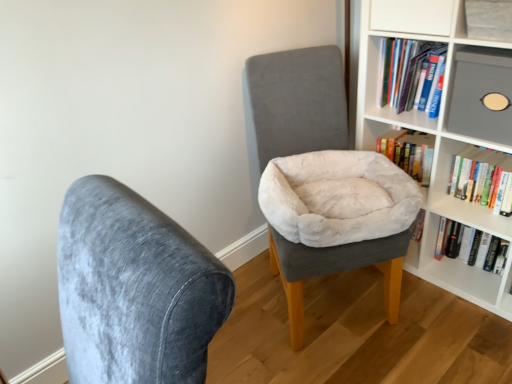
Where is `free space to the right of velvet gray chair at center, the second chair in the front-to-back sequence`? free space to the right of velvet gray chair at center, the second chair in the front-to-back sequence is located at coordinates (443, 316).